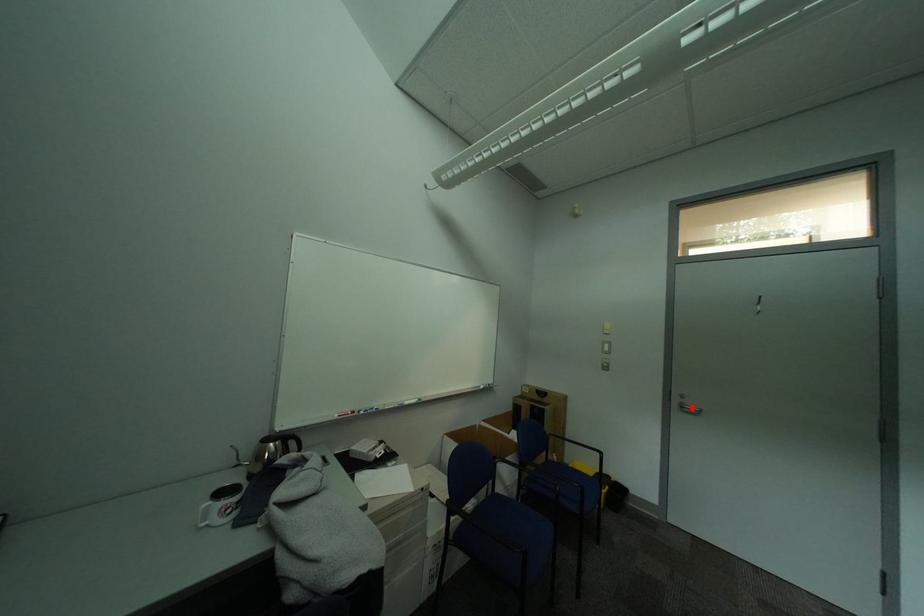
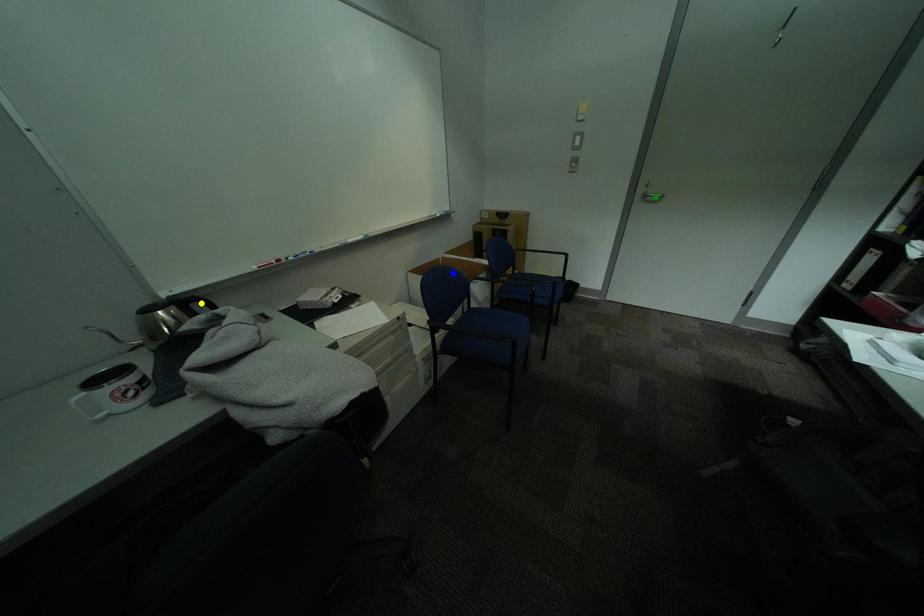
Question: I am providing you with two images of the same scene from different viewpoints. A red point is marked on the first image. You are given multiple points on the second image. Which mark in image 2 goes with the point in image 1?

Choices:
 (A) blue point
 (B) green point
 (C) yellow point

Answer: (B)